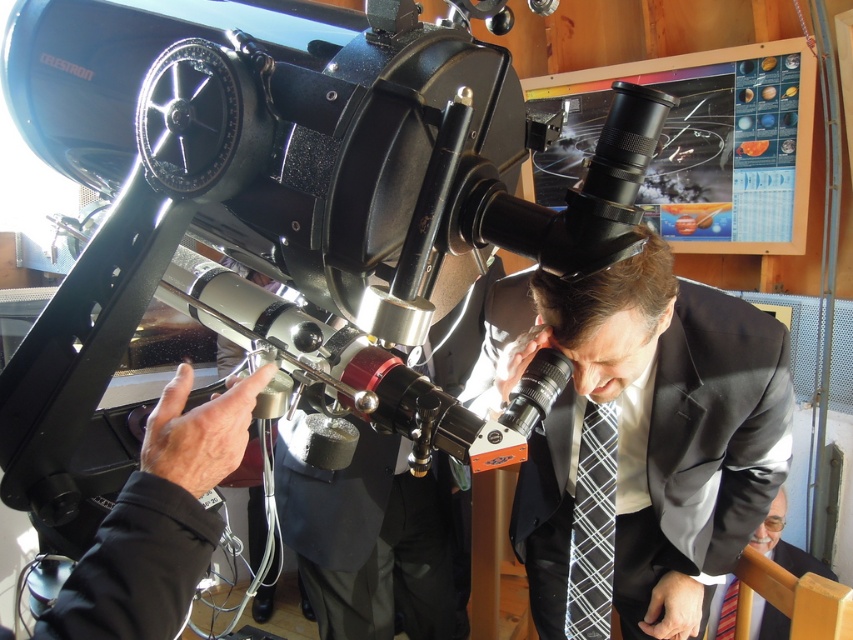
Between white shirt at center and striped fabric tie at lower right, which one appears on the right side from the viewer's perspective?

white shirt at center is more to the right.

Is white shirt at center below striped fabric tie at lower right?

No, white shirt at center is not below striped fabric tie at lower right.

Where is `white shirt at center`? The image size is (853, 640). white shirt at center is located at coordinates (785, 544).

Does dark gray suit at center appear over black silk business suit at center?

Indeed, dark gray suit at center is positioned over black silk business suit at center.

From the picture: Does dark gray suit at center have a greater width compared to black silk business suit at center?

Yes, dark gray suit at center is wider than black silk business suit at center.

The height and width of the screenshot is (640, 853). Describe the element at coordinates (641, 442) in the screenshot. I see `dark gray suit at center` at that location.

Locate an element on the screen. dark gray suit at center is located at coordinates (641, 442).

Is black checkered tie at lower right closer to the viewer compared to white shirt at center?

Yes, it is in front of white shirt at center.

Does point (581, 568) come behind point (717, 605)?

No, (581, 568) is closer to viewer.

You are a GUI agent. You are given a task and a screenshot of the screen. Output one action in this format:
    pyautogui.click(x=<x>, y=<y>)
    Task: Click on the black checkered tie at lower right
    The image size is (853, 640).
    Given the screenshot: What is the action you would take?
    pyautogui.click(x=592, y=525)